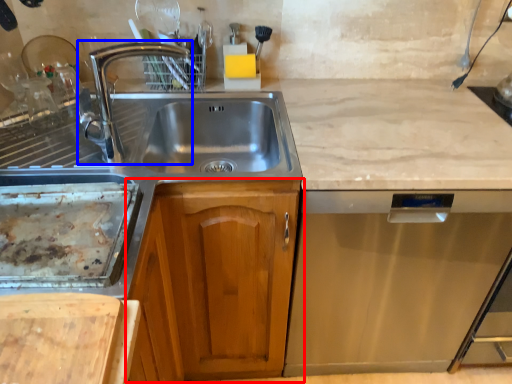
Question: Which point is closer to the camera, cabinetry (highlighted by a red box) or tap (highlighted by a blue box)?

Choices:
 (A) cabinetry
 (B) tap

Answer: (B)